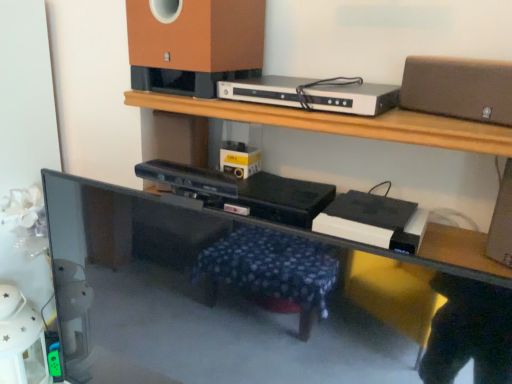
Question: In terms of width, does matte brown speaker at upper center, which appears as the 2th speaker when viewed from the right, look wider or thinner when compared to silver metallic dvd player at upper center?

Choices:
 (A) thin
 (B) wide

Answer: (B)

Question: Is matte brown speaker at upper center, the first speaker in the left-to-right sequence, bigger or smaller than silver metallic dvd player at upper center?

Choices:
 (A) small
 (B) big

Answer: (B)

Question: Based on their relative distances, which object is nearer to the matte brown speaker at upper center, which appears as the 2th speaker when viewed from the right?

Choices:
 (A) matte brown speaker at upper right, placed as the second speaker when sorted from left to right
 (B) black glossy computer desk at lower left
 (C) silver metallic dvd player at upper center

Answer: (C)

Question: Which object is positioned closest to the black glossy computer desk at lower left?

Choices:
 (A) matte brown speaker at upper right, acting as the 1th speaker starting from the right
 (B) matte brown speaker at upper center, the first speaker in the left-to-right sequence
 (C) silver metallic dvd player at upper center

Answer: (C)